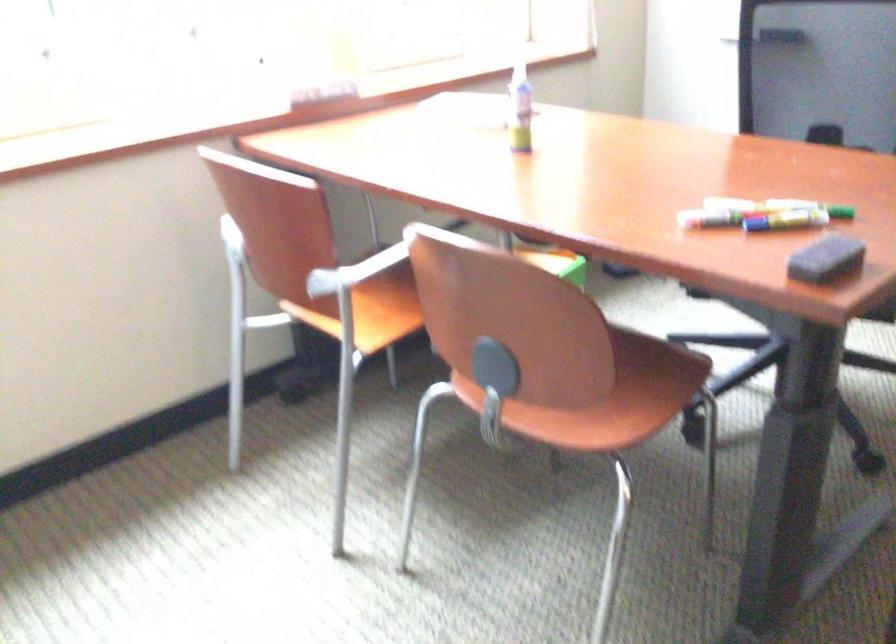
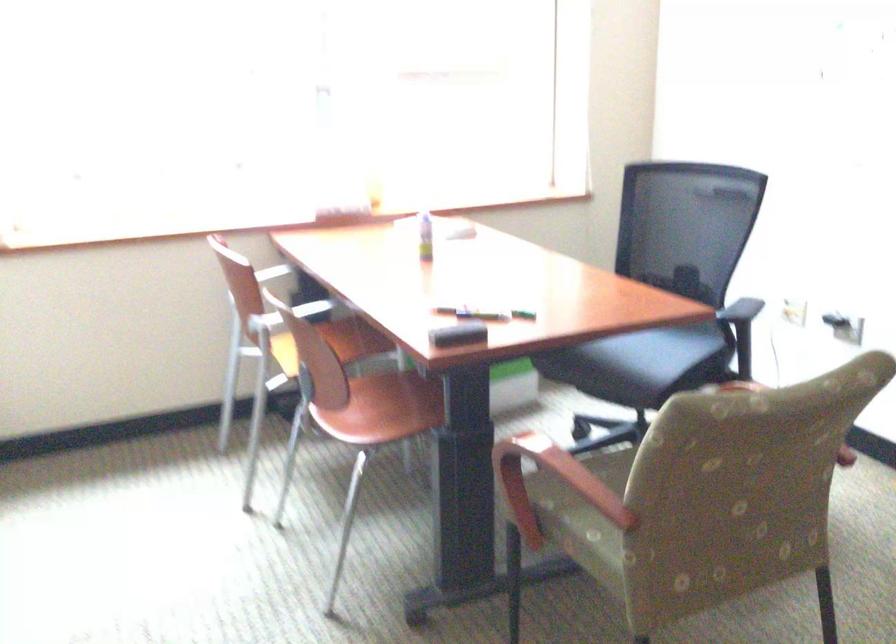
Locate, in the second image, the point that corresponds to pixel 341 109 in the first image.

(346, 214)